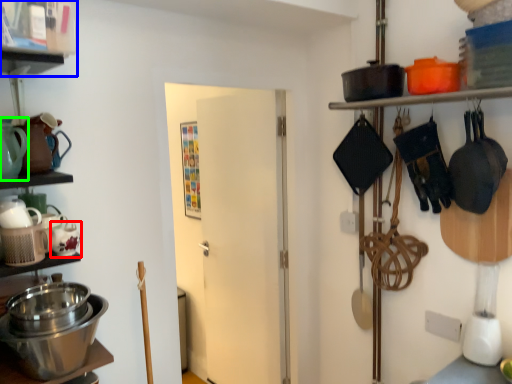
Question: Which object is the closest to the tea pot (highlighted by a red box)? Choose among these: shelf (highlighted by a blue box) or tea pot (highlighted by a green box).

Choices:
 (A) shelf
 (B) tea pot

Answer: (B)